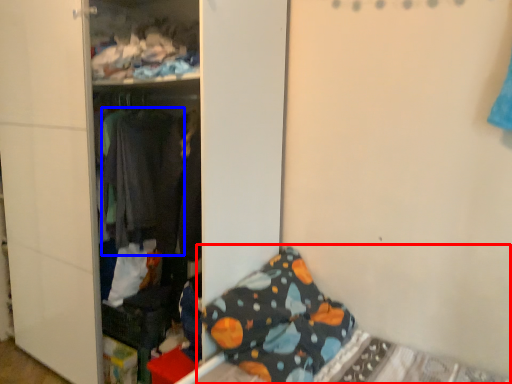
Question: Which object appears farthest to the camera in this image, bed (highlighted by a red box) or clothing (highlighted by a blue box)?

Choices:
 (A) bed
 (B) clothing

Answer: (B)